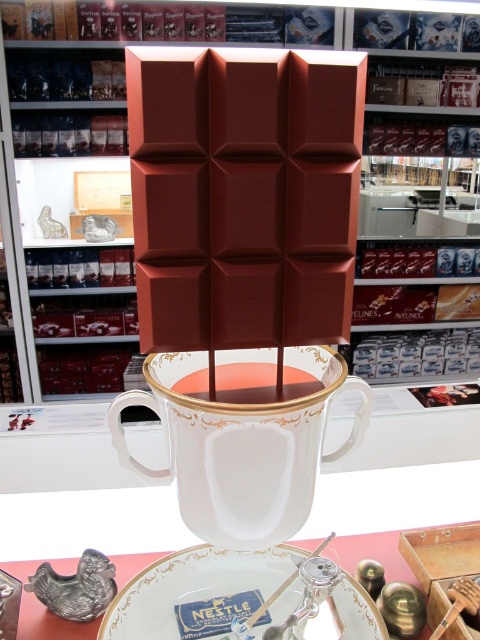
Question: Considering the real-world distances, which object is closest to the white porcelain plate at center?

Choices:
 (A) white porcelain cup at center
 (B) white glossy saucer at center

Answer: (B)

Question: Which of the following is the farthest from the observer?

Choices:
 (A) (120, 602)
 (B) (173, 424)

Answer: (A)

Question: Does white glossy saucer at center have a smaller size compared to white porcelain plate at center?

Choices:
 (A) yes
 (B) no

Answer: (A)

Question: Is white porcelain cup at center positioned before white glossy saucer at center?

Choices:
 (A) no
 (B) yes

Answer: (B)

Question: Is white porcelain cup at center below white glossy saucer at center?

Choices:
 (A) no
 (B) yes

Answer: (A)

Question: Estimate the real-world distances between objects in this image. Which object is closer to the white porcelain plate at center?

Choices:
 (A) white glossy saucer at center
 (B) white porcelain cup at center

Answer: (A)